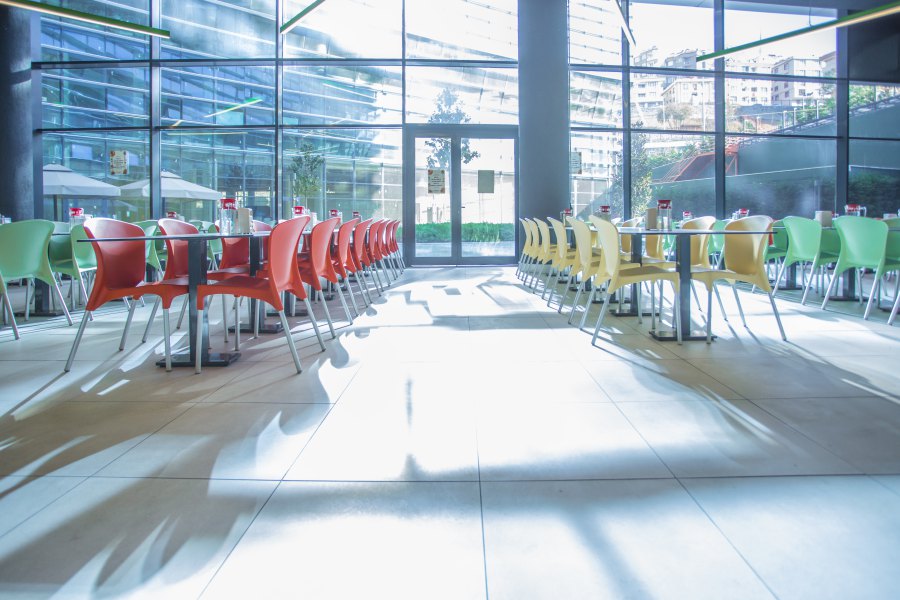
Find the location of a particular element. square tables is located at coordinates (207, 237), (684, 233), (633, 230), (263, 231), (58, 234), (307, 232), (569, 228), (828, 229), (777, 229).